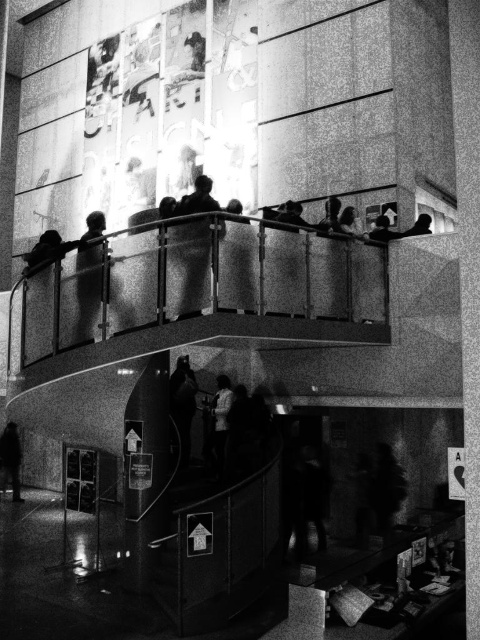
Question: Which point is farther from the camera taking this photo?

Choices:
 (A) (4, 483)
 (B) (82, 291)
 (C) (199, 221)

Answer: (A)

Question: In this image, where is dark textured jacket at center located relative to white fabric jacket at center?

Choices:
 (A) right
 (B) left

Answer: (B)

Question: Estimate the real-world distances between objects in this image. Which object is farther from the white fabric jacket at center?

Choices:
 (A) dark textured jacket at center
 (B) smooth black jacket at lower left

Answer: (B)

Question: Is dark textured jacket at center smaller than smooth black jacket at upper left?

Choices:
 (A) no
 (B) yes

Answer: (A)

Question: Which point is farther to the camera?

Choices:
 (A) dark textured jacket at center
 (B) white fabric jacket at center
 (C) smooth black jacket at lower left
 (D) smooth black jacket at upper left

Answer: (C)

Question: Is smooth black jacket at upper left in front of smooth black jacket at lower left?

Choices:
 (A) yes
 (B) no

Answer: (A)